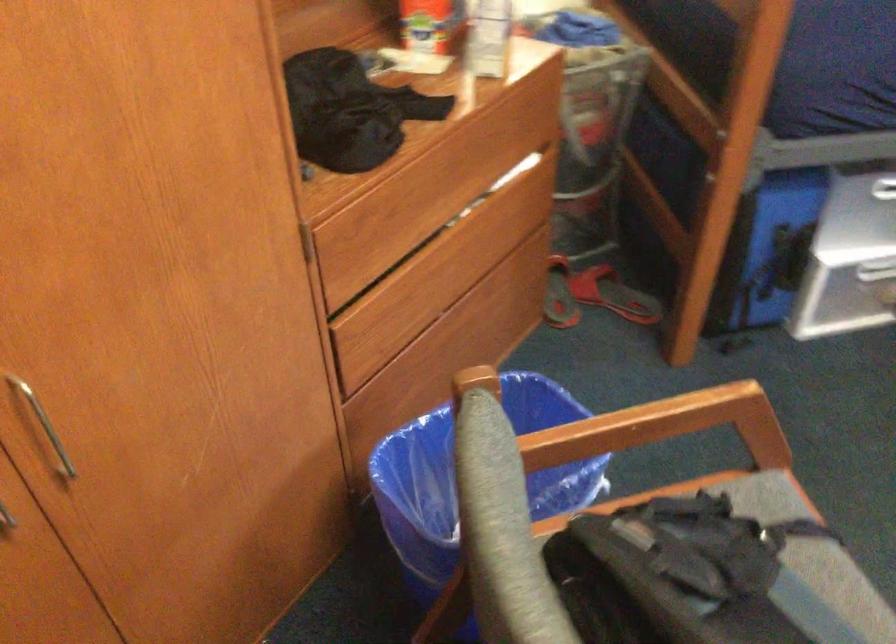
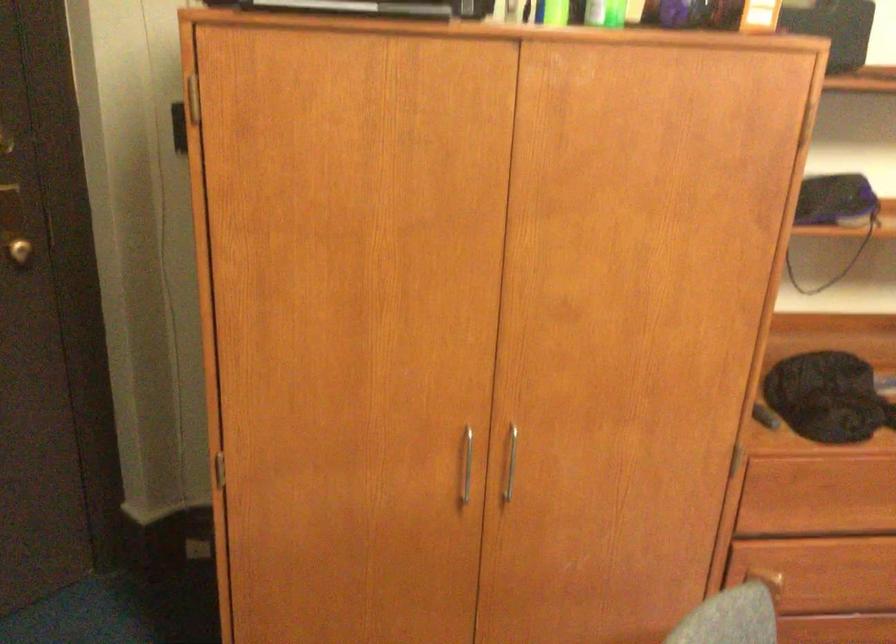
Question: The first image is from the beginning of the video and the second image is from the end. How did the camera likely rotate when shooting the video?

Choices:
 (A) Left
 (B) Right
 (C) Up
 (D) Down

Answer: (A)